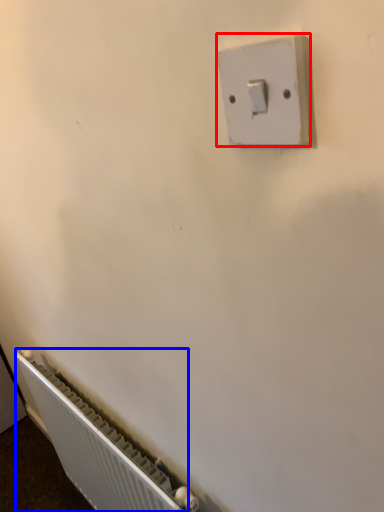
Question: Which of the following is the closest to the observer, light switch (highlighted by a red box) or radiator (highlighted by a blue box)?

Choices:
 (A) light switch
 (B) radiator

Answer: (A)